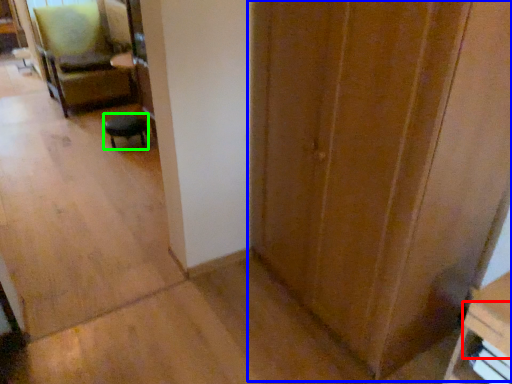
Question: Which is farther away from drawer (highlighted by a red box)? door (highlighted by a blue box) or furniture (highlighted by a green box)?

Choices:
 (A) door
 (B) furniture

Answer: (B)